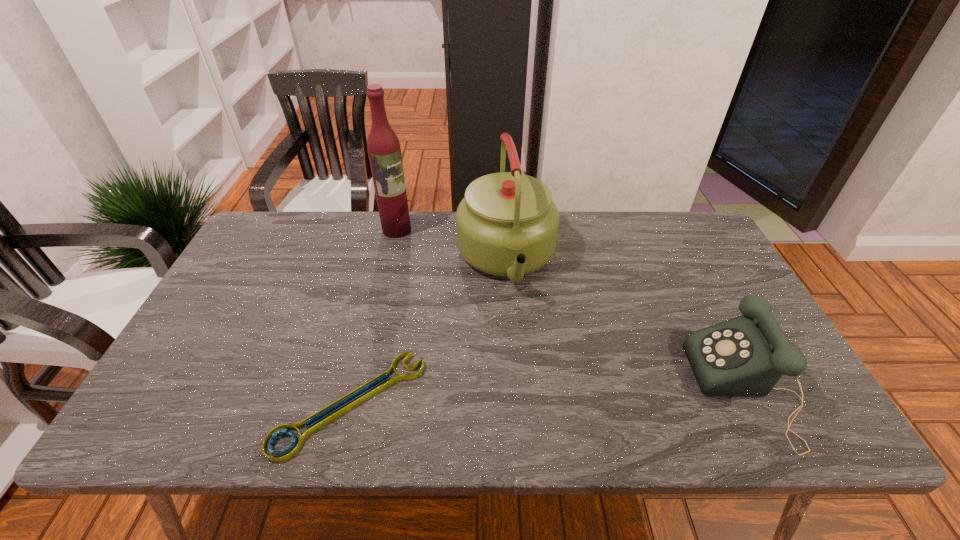
At what (x,y) coordinates should I click in order to perform the action: click on vacant space that satisfies the following two spatial constraints: 1. on the front side of the kettle; 2. on the dial of the second shortest object. Please return your answer as a coordinate pair (x, y). The width and height of the screenshot is (960, 540). Looking at the image, I should click on (515, 389).

Identify the location of vacant position in the image that satisfies the following two spatial constraints: 1. on the back side of the third shortest object; 2. on the left side of the wrench. (385, 259).

You are a GUI agent. You are given a task and a screenshot of the screen. Output one action in this format:
    pyautogui.click(x=<x>, y=<y>)
    Task: Click on the free location that satisfies the following two spatial constraints: 1. on the back side of the shortest object; 2. on the right side of the kettle
    The image size is (960, 540).
    Given the screenshot: What is the action you would take?
    pyautogui.click(x=385, y=259)